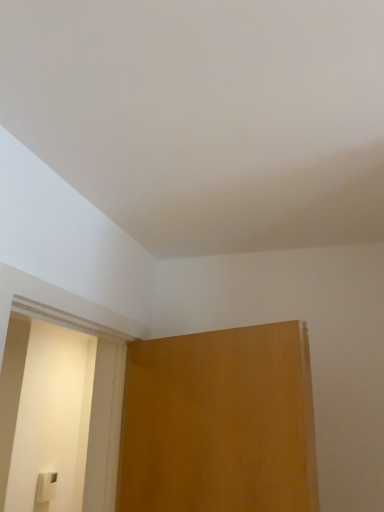
Question: Considering their positions, is white plastic light switch at lower left located in front of or behind matte wood screen door at left?

Choices:
 (A) front
 (B) behind

Answer: (B)

Question: Is white plastic light switch at lower left wider or thinner than matte wood screen door at left?

Choices:
 (A) wide
 (B) thin

Answer: (B)

Question: Is point (52, 483) positioned closer to the camera than point (41, 446)?

Choices:
 (A) farther
 (B) closer

Answer: (A)

Question: Considering the positions of matte wood screen door at left and white plastic light switch at lower left in the image, is matte wood screen door at left bigger or smaller than white plastic light switch at lower left?

Choices:
 (A) small
 (B) big

Answer: (B)

Question: Is point (61, 426) closer or farther from the camera than point (41, 480)?

Choices:
 (A) farther
 (B) closer

Answer: (A)

Question: From the image's perspective, is matte wood screen door at left positioned above or below white plastic light switch at lower left?

Choices:
 (A) below
 (B) above

Answer: (B)

Question: From a real-world perspective, is matte wood screen door at left positioned above or below white plastic light switch at lower left?

Choices:
 (A) below
 (B) above

Answer: (B)